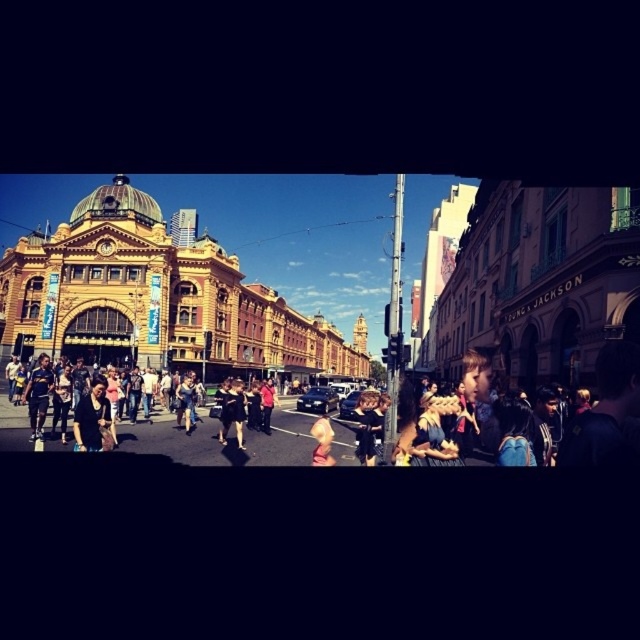
Question: Observing the image, what is the correct spatial positioning of matte black jacket at center in reference to light brown hair at center?

Choices:
 (A) above
 (B) below

Answer: (A)

Question: Which point is farther to the camera?

Choices:
 (A) (333, 435)
 (B) (90, 406)

Answer: (A)

Question: Observing the image, what is the correct spatial positioning of matte black jacket at center in reference to light brown hair at center?

Choices:
 (A) right
 (B) left

Answer: (B)

Question: Does matte black jacket at center appear on the right side of light brown hair at center?

Choices:
 (A) yes
 (B) no

Answer: (B)